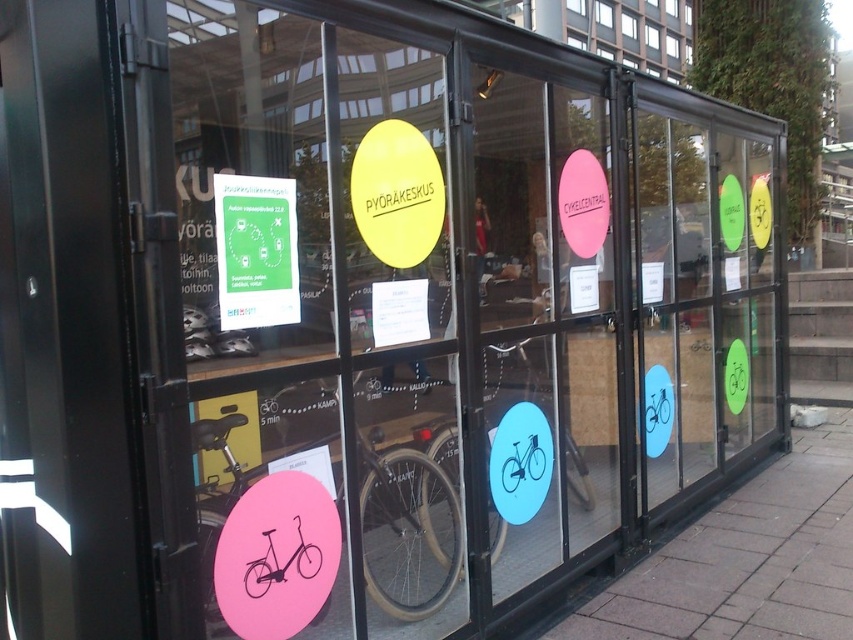
You are standing in front of the glass structure and want to locate the pink matte sign at center. Where exactly is it positioned on the glass panels?

The pink matte sign at center is positioned at the coordinates point (544,316) on the glass panels.

You are a visitor at the bike station and want to read the text on the clear glass window at upper center. However, there is a pink matte sign at center blocking your view. Can you move the sign to see the window?

The pink matte sign at center is in front of the clear glass window at upper center, so moving the sign would allow you to see the window.